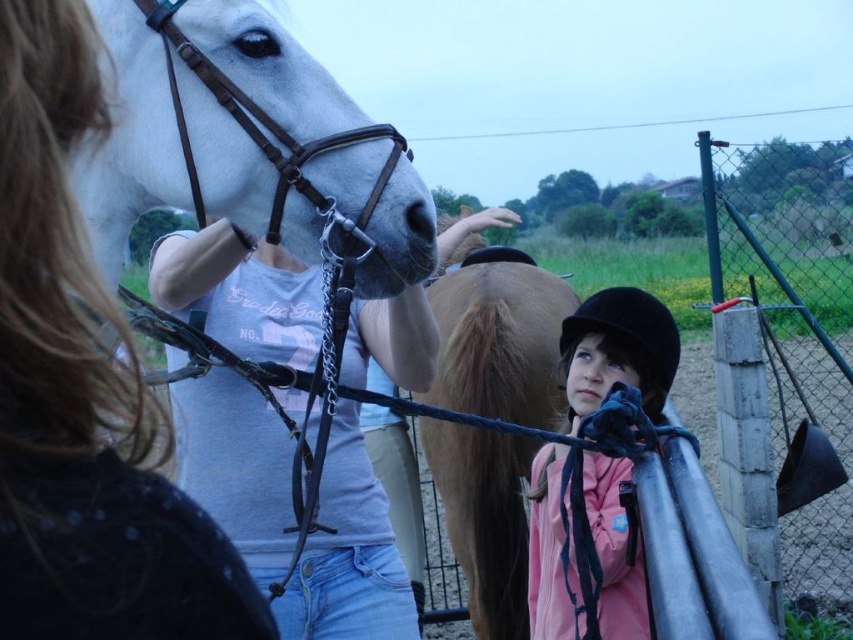
Between metallic chain-link fence at right and pink fleece jacket at center, which one is positioned higher?

metallic chain-link fence at right

Can you confirm if metallic chain-link fence at right is thinner than pink fleece jacket at center?

In fact, metallic chain-link fence at right might be wider than pink fleece jacket at center.

Between point (819, 180) and point (653, 323), which one is positioned in front?

Point (653, 323) is more forward.

This screenshot has width=853, height=640. In order to click on metallic chain-link fence at right in this screenshot , I will do `click(795, 320)`.

Can you confirm if white leather bridle at upper left is positioned to the left of metallic chain-link fence at right?

Indeed, white leather bridle at upper left is positioned on the left side of metallic chain-link fence at right.

Consider the image. Is white leather bridle at upper left positioned before metallic chain-link fence at right?

Yes, it is in front of metallic chain-link fence at right.

Where is `white leather bridle at upper left`? white leather bridle at upper left is located at coordinates (294, 145).

Where is `white leather bridle at upper left`? This screenshot has height=640, width=853. white leather bridle at upper left is located at coordinates (294, 145).

Between matte white horse at left and brown glossy horse at center, which one appears on the right side from the viewer's perspective?

brown glossy horse at center

From the picture: Is matte white horse at left bigger than brown glossy horse at center?

No.

The image size is (853, 640). In order to click on matte white horse at left in this screenshot , I will do `click(83, 392)`.

Where is `matte white horse at left`? The height and width of the screenshot is (640, 853). matte white horse at left is located at coordinates [x=83, y=392].